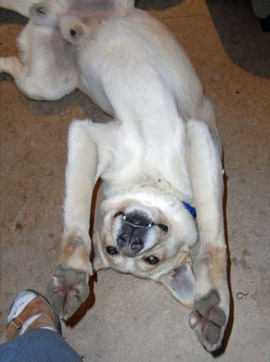
You are a GUI agent. You are given a task and a screenshot of the screen. Output one action in this format:
    pyautogui.click(x=<x>, y=<y>)
    Task: Click on the tan rug
    The image size is (270, 362).
    Given the screenshot: What is the action you would take?
    pyautogui.click(x=168, y=349)